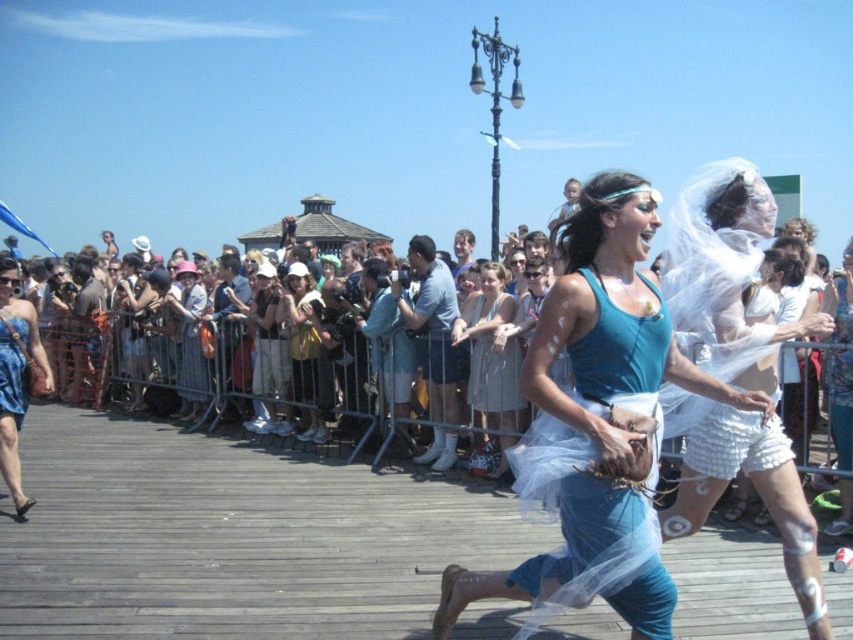
Question: Which of the following is the closest to the observer?

Choices:
 (A) light beige fabric dress at center
 (B) white sheer veil at center
 (C) white sheer dress at center

Answer: (B)

Question: Based on their relative distances, which object is farther from the white sheer veil at center?

Choices:
 (A) wooden dock at center
 (B) blue denim dress at lower left

Answer: (B)

Question: Does wooden dock at center appear over white sheer veil at center?

Choices:
 (A) no
 (B) yes

Answer: (A)

Question: Does white sheer veil at center have a greater width compared to light beige fabric dress at center?

Choices:
 (A) yes
 (B) no

Answer: (A)

Question: From the image, what is the correct spatial relationship of white sheer veil at center in relation to blue denim shorts at center?

Choices:
 (A) left
 (B) right

Answer: (B)

Question: Which of the following is the closest to the observer?

Choices:
 (A) (506, 360)
 (B) (289, 317)
 (C) (740, 188)

Answer: (C)